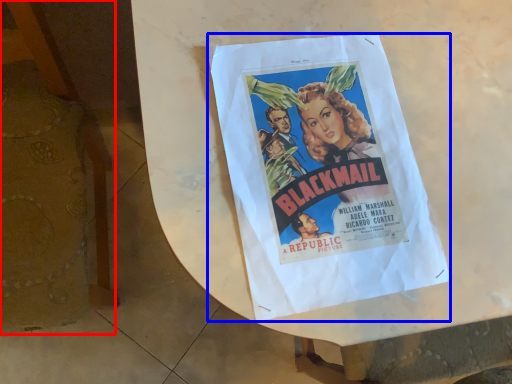
Question: Which object is closer to the camera taking this photo, furniture (highlighted by a red box) or poster (highlighted by a blue box)?

Choices:
 (A) furniture
 (B) poster

Answer: (A)